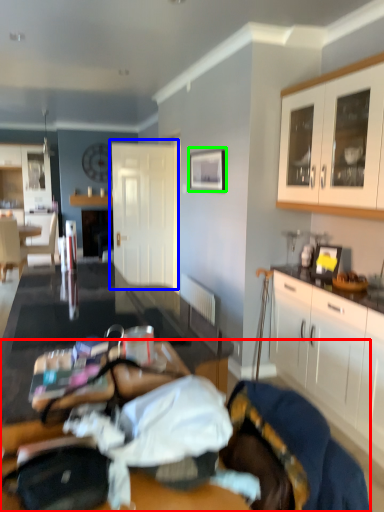
Question: Considering the real-world distances, which object is farthest from bed (highlighted by a red box)? door (highlighted by a blue box) or picture frame (highlighted by a green box)?

Choices:
 (A) door
 (B) picture frame

Answer: (A)